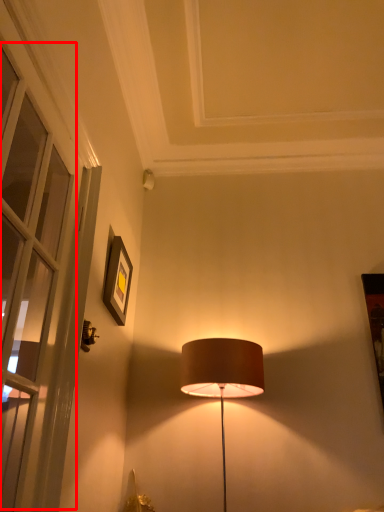
Question: From the image, what is the correct spatial relationship of window (annotated by the red box) in relation to picture frame?

Choices:
 (A) left
 (B) right

Answer: (A)